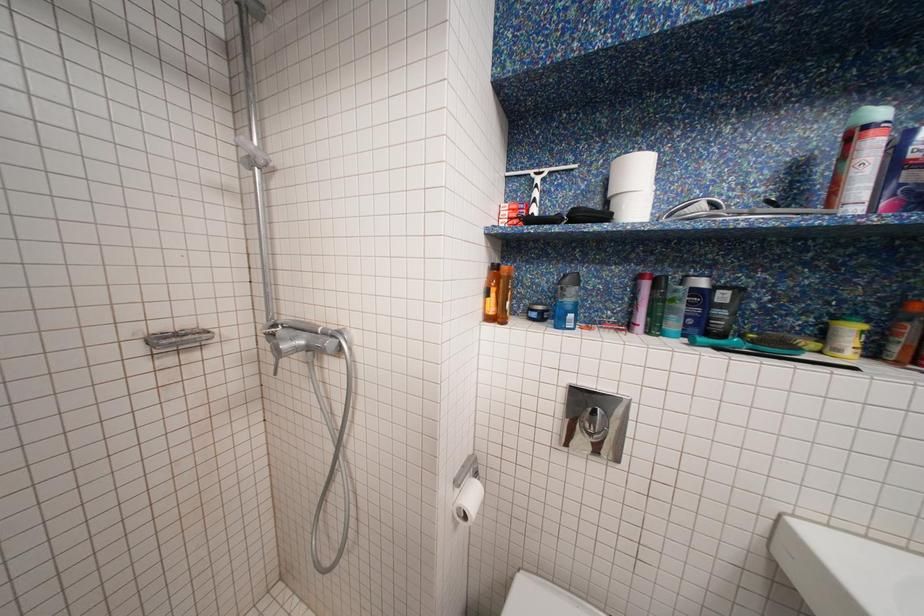
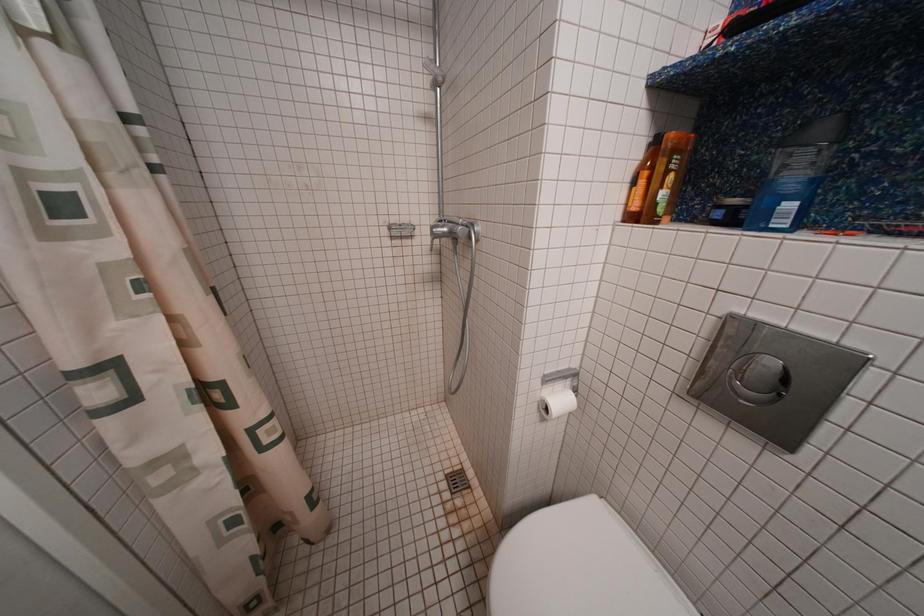
Question: The camera is either moving clockwise (left) or counter-clockwise (right) around the object. The first image is from the beginning of the video and the second image is from the end. Is the camera moving left or right when shooting the video?

Choices:
 (A) Left
 (B) Right

Answer: (B)